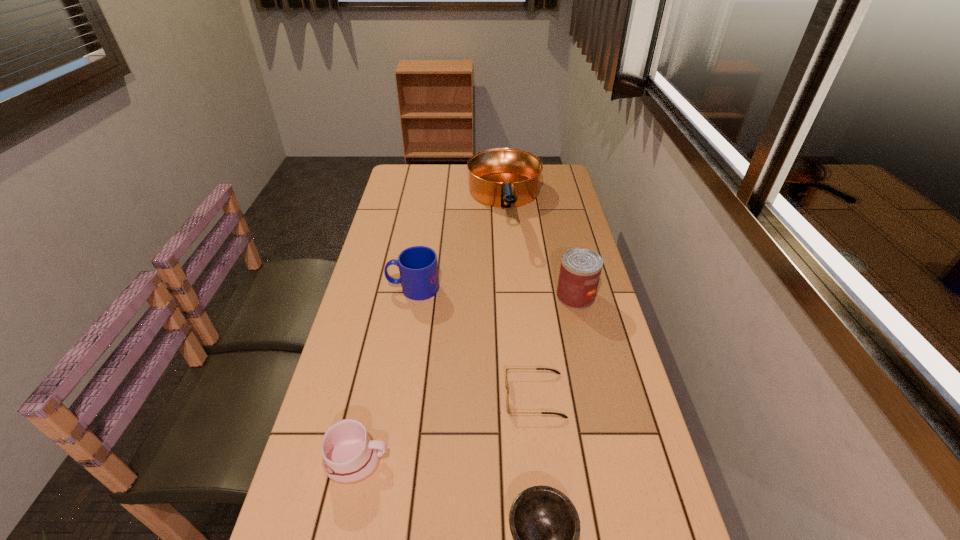
Image resolution: width=960 pixels, height=540 pixels. Find the location of `vacant area at the far edge of the desktop`. vacant area at the far edge of the desktop is located at coordinates (453, 190).

At what (x,y) coordinates should I click in order to perform the action: click on vacant area at the left edge. Please return your answer as a coordinate pair (x, y). The image size is (960, 540). Looking at the image, I should click on (365, 306).

Identify the location of free space at the right edge of the desktop. (553, 249).

Image resolution: width=960 pixels, height=540 pixels. In the image, there is a desktop. Find the location of `vacant area at the far right corner`. vacant area at the far right corner is located at coordinates (550, 183).

At what (x,y) coordinates should I click in order to perform the action: click on vacant region between the shortest object and the can. Please return your answer as a coordinate pair (x, y). The width and height of the screenshot is (960, 540). Looking at the image, I should click on (555, 346).

The width and height of the screenshot is (960, 540). Identify the location of free space between the tallest object and the taller mug. (459, 246).

Where is `vacant space in between the shorter mug and the taller mug`? The height and width of the screenshot is (540, 960). vacant space in between the shorter mug and the taller mug is located at coordinates (385, 374).

Locate an element on the screen. The height and width of the screenshot is (540, 960). free space between the fourth shortest object and the second tallest object is located at coordinates (494, 292).

Find the location of `free spot between the sunglasses and the nearer mug`. free spot between the sunglasses and the nearer mug is located at coordinates (445, 428).

At what (x,y) coordinates should I click in order to perform the action: click on unoccupied position between the can and the shorter mug. Please return your answer as a coordinate pair (x, y). This screenshot has width=960, height=540. Looking at the image, I should click on (466, 379).